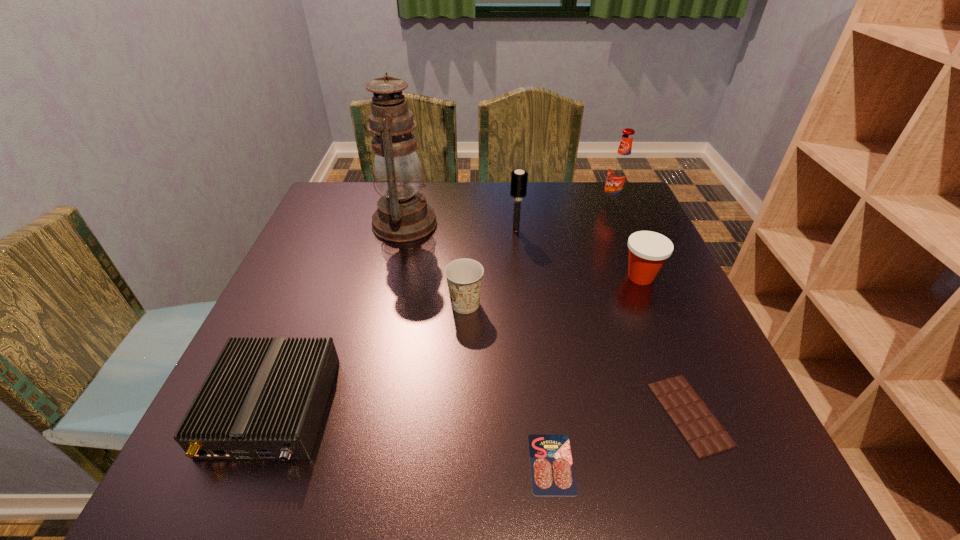
In order to click on oil lamp in this screenshot , I will do `click(403, 215)`.

Identify the location of the second tallest object. (619, 173).

Where is `hairbrush`? Image resolution: width=960 pixels, height=540 pixels. hairbrush is located at coordinates (519, 178).

Identify the location of the farther Dixie cup. (648, 250).

I want to click on the fifth nearest object, so click(648, 250).

Where is `the sixth object from right to left`? the sixth object from right to left is located at coordinates (464, 276).

Locate an element on the screen. the nearer Dixie cup is located at coordinates (464, 276).

You are a GUI agent. You are given a task and a screenshot of the screen. Output one action in this format:
    pyautogui.click(x=<x>, y=<y>)
    Task: Click on the sixth tallest object
    This screenshot has height=540, width=960.
    Given the screenshot: What is the action you would take?
    pyautogui.click(x=263, y=398)

Where is `the seventh tallest object`? the seventh tallest object is located at coordinates (702, 431).

You are a GUI agent. You are given a task and a screenshot of the screen. Output one action in this format:
    pyautogui.click(x=<x>, y=<y>)
    Task: Click on the shortest object
    The width and height of the screenshot is (960, 540).
    Given the screenshot: What is the action you would take?
    pyautogui.click(x=552, y=473)